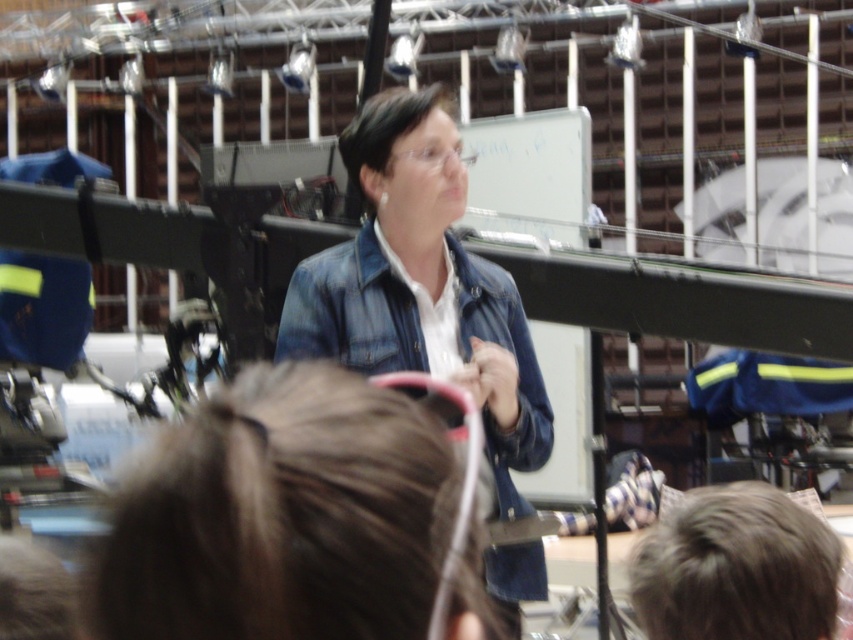
Question: In this image, where is brown straight hair at center located relative to dark brown hair at center?

Choices:
 (A) right
 (B) left

Answer: (A)

Question: Does denim jacket at center have a greater width compared to brown matte hair at lower right?

Choices:
 (A) yes
 (B) no

Answer: (A)

Question: Which object appears farthest from the camera in this image?

Choices:
 (A) brown straight hair at center
 (B) brown matte hair at lower right
 (C) dark brown hair at center

Answer: (C)

Question: Which point is farther to the camera?

Choices:
 (A) (425, 204)
 (B) (351, 161)
 (C) (386, 476)

Answer: (B)

Question: Observing the image, what is the correct spatial positioning of brown straight hair at center in reference to dark brown hair at center?

Choices:
 (A) below
 (B) above

Answer: (A)

Question: Which of these objects is positioned closest to the brown straight hair at center?

Choices:
 (A) denim jacket at center
 (B) dark brown hair at center

Answer: (A)